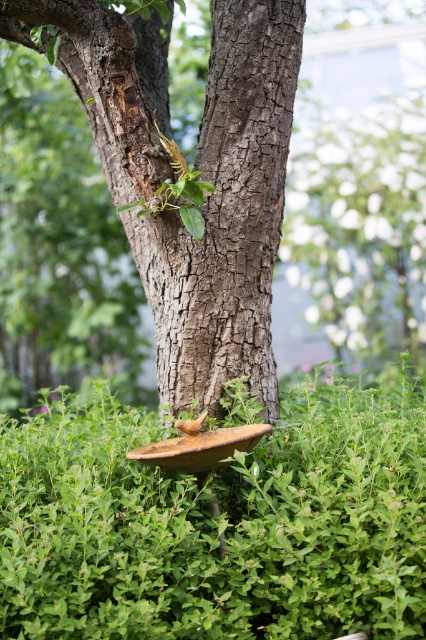
Question: Which object is farther from the camera taking this photo?

Choices:
 (A) rough bark tree trunk at center
 (B) green leafy hedge at lower center

Answer: (A)

Question: Which of the following is the closest to the observer?

Choices:
 (A) (26, 442)
 (B) (221, 253)

Answer: (B)

Question: Can you confirm if green leafy hedge at lower center is wider than rough bark tree trunk at center?

Choices:
 (A) yes
 (B) no

Answer: (A)

Question: Is green leafy hedge at lower center smaller than rough bark tree trunk at center?

Choices:
 (A) yes
 (B) no

Answer: (A)

Question: Is green leafy hedge at lower center behind rough bark tree trunk at center?

Choices:
 (A) no
 (B) yes

Answer: (A)